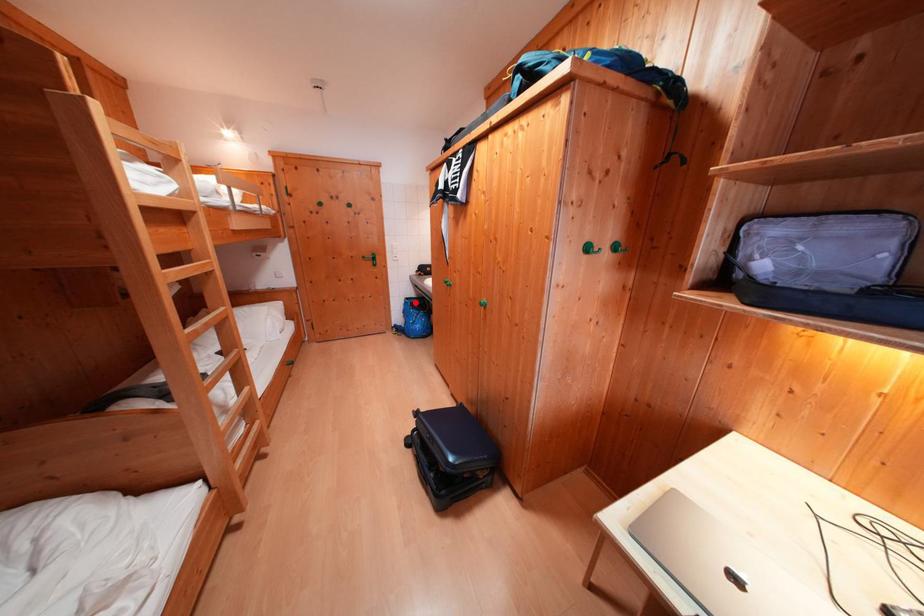
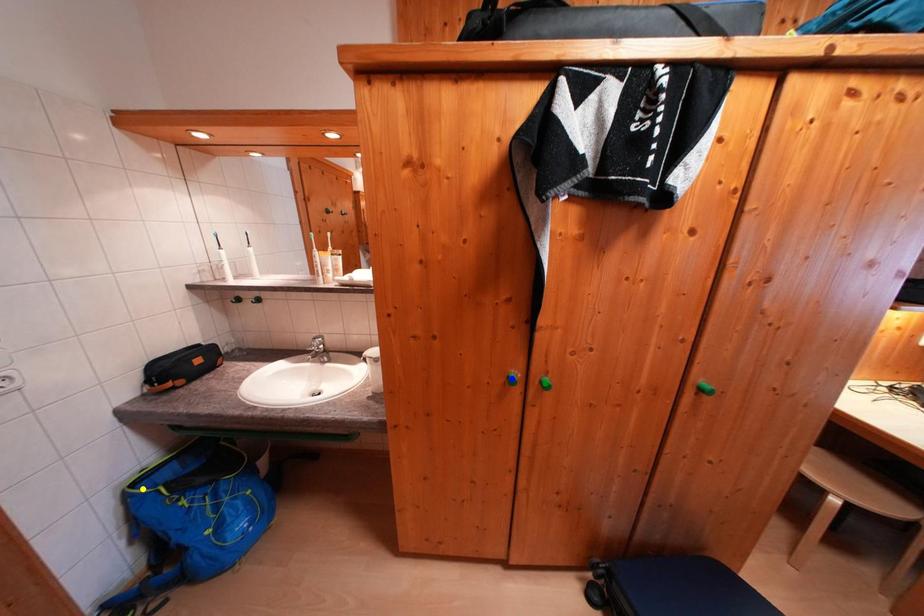
Question: I am providing you with two images of the same scene from different viewpoints. A red point is marked on the first image. You are given multiple points on the second image. Which point in image 2 represents the same 3d spot as the red point in image 1?

Choices:
 (A) blue point
 (B) yellow point
 (C) green point

Answer: (B)